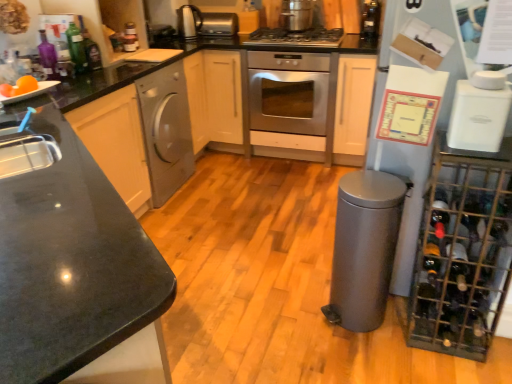
Question: From a real-world perspective, is satin silver toaster at upper center, marked as the 3th appliance in a bottom-to-top arrangement, above or below stainless steel pot at upper center, the 2th kitchen appliance in the front-to-back sequence?

Choices:
 (A) below
 (B) above

Answer: (A)

Question: Considering the positions of satin silver toaster at upper center, marked as the 3th appliance in a bottom-to-top arrangement, and stainless steel pot at upper center, which is the first kitchen appliance from back to front, in the image, is satin silver toaster at upper center, marked as the 3th appliance in a bottom-to-top arrangement, taller or shorter than stainless steel pot at upper center, which is the first kitchen appliance from back to front,?

Choices:
 (A) tall
 (B) short

Answer: (A)

Question: Estimate the real-world distances between objects in this image. Which object is farther from the polished stainless steel kettle at upper left, placed as the 2th appliance when sorted from bottom to top?

Choices:
 (A) dark glass wine bottle at lower right
 (B) white plastic appliance at upper right, the second kitchen appliance viewed from the top
 (C) stainless steel gas stove at center
 (D) stainless steel oven at center
 (E) translucent glass bottle at upper right, the first bottle in the right-to-left sequence

Answer: (A)

Question: Based on their relative distances, which object is nearer to the white plastic appliance at upper right, acting as the second kitchen appliance starting from the left?

Choices:
 (A) purple glass bottle at upper left, the first bottle when ordered from bottom to top
 (B) orange matte at left
 (C) green glass bottle at upper left, the 3th bottle positioned from the bottom
 (D) stainless steel gas stove at center
 (E) satin silver toaster at upper center, the first appliance positioned from the back

Answer: (D)